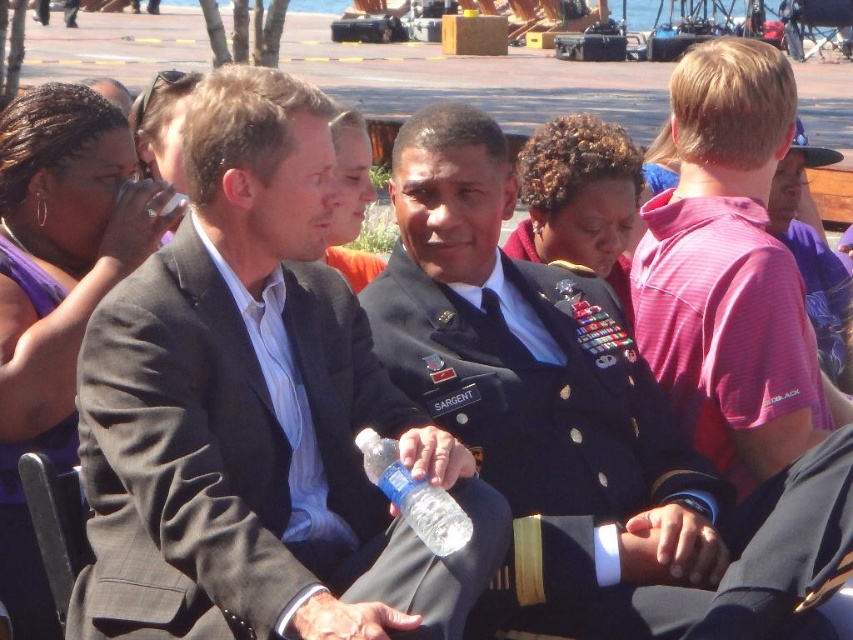
Question: Which object is the closest to the navy blue uniform at center?

Choices:
 (A) matte black suit at center
 (B) pink striped shirt at right
 (C) matte gray suit at center
 (D) clear plastic bottle at center

Answer: (C)

Question: Which point is farther to the camera?

Choices:
 (A) (44, 604)
 (B) (428, 536)
 (C) (809, 252)
 (D) (758, 596)

Answer: (C)

Question: Can you confirm if navy blue uniform at center is positioned below navy blue fabric uniform at center?

Choices:
 (A) yes
 (B) no

Answer: (B)

Question: Does navy blue uniform at center appear over navy blue fabric uniform at center?

Choices:
 (A) yes
 (B) no

Answer: (A)

Question: Is matte gray suit at center below matte black suit at center?

Choices:
 (A) yes
 (B) no

Answer: (A)

Question: Which of the following is the closest to the observer?

Choices:
 (A) matte black suit at center
 (B) navy blue uniform at center
 (C) navy blue fabric uniform at center

Answer: (B)